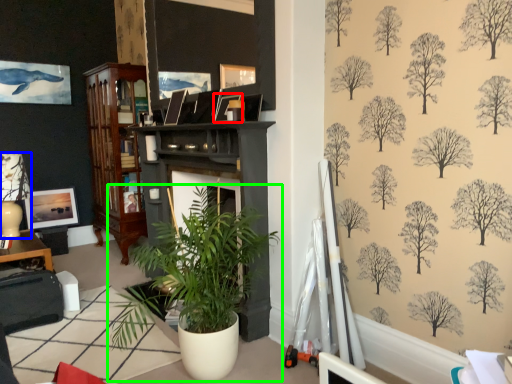
Question: Considering the real-world distances, which object is closest to picture frame (highlighted by a red box)? lamp (highlighted by a blue box) or houseplant (highlighted by a green box).

Choices:
 (A) lamp
 (B) houseplant

Answer: (B)